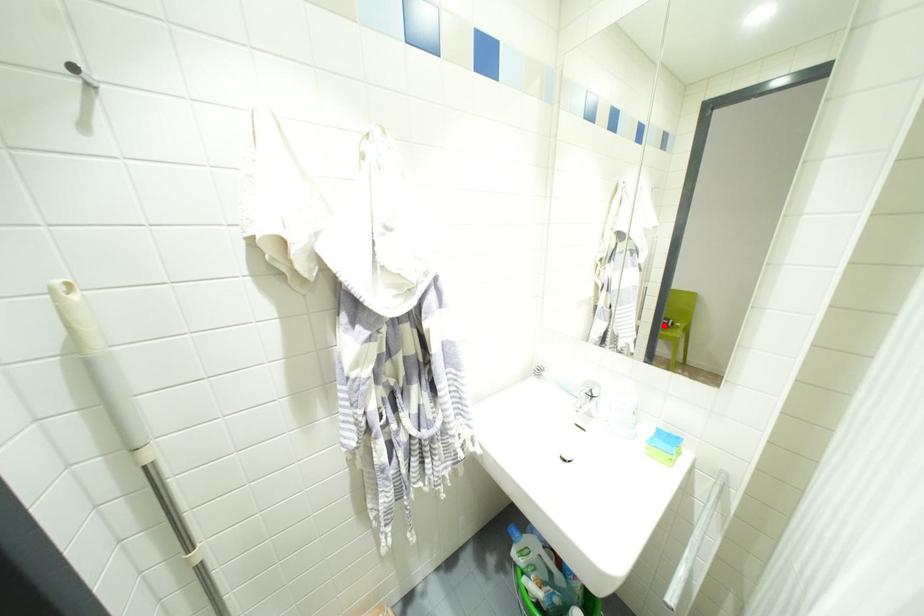
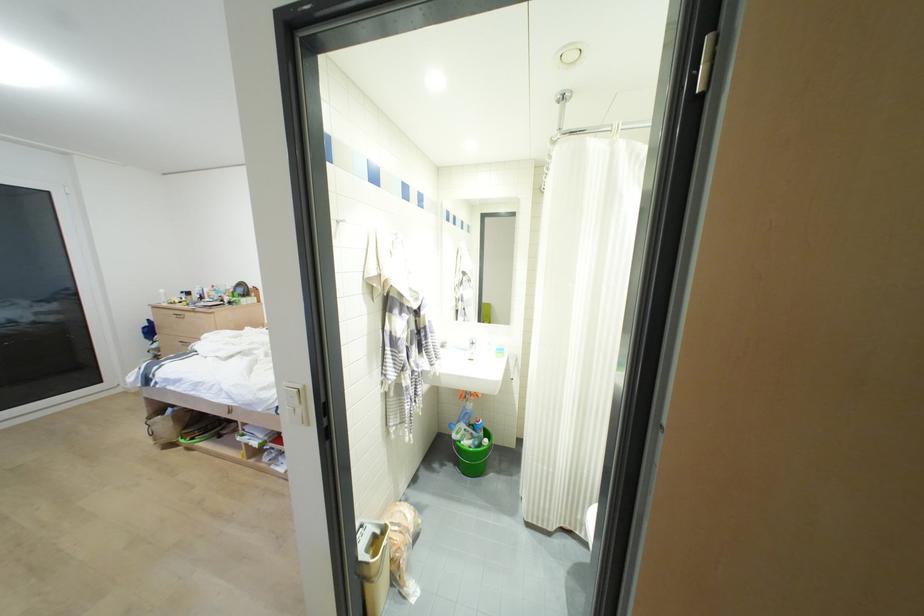
Question: I am providing you with two images of the same scene from different viewpoints. A red point is marked on the first image. Is the red point's position out of view in image 2?

Choices:
 (A) Yes
 (B) No

Answer: (A)